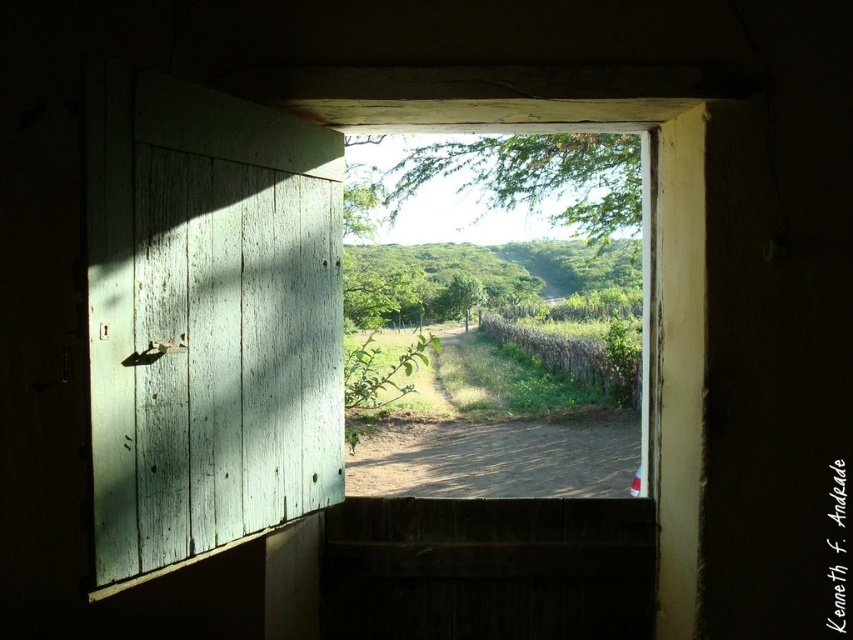
You are standing inside the structure and looking through the partially open wooden door. There is a point marked at coordinates (537, 182). What object is located at this point?

The point at coordinates (537, 182) corresponds to the green wooden fence at center.

From the picture: You are standing inside the structure and want to exit through the green painted wood door at left. Based on the door position, which direction should you walk to reach it?

The green painted wood door at left is positioned at point 0.500 on the horizontal axis, which is the center of the image. Therefore, you should walk straight ahead to reach the green painted wood door at left.